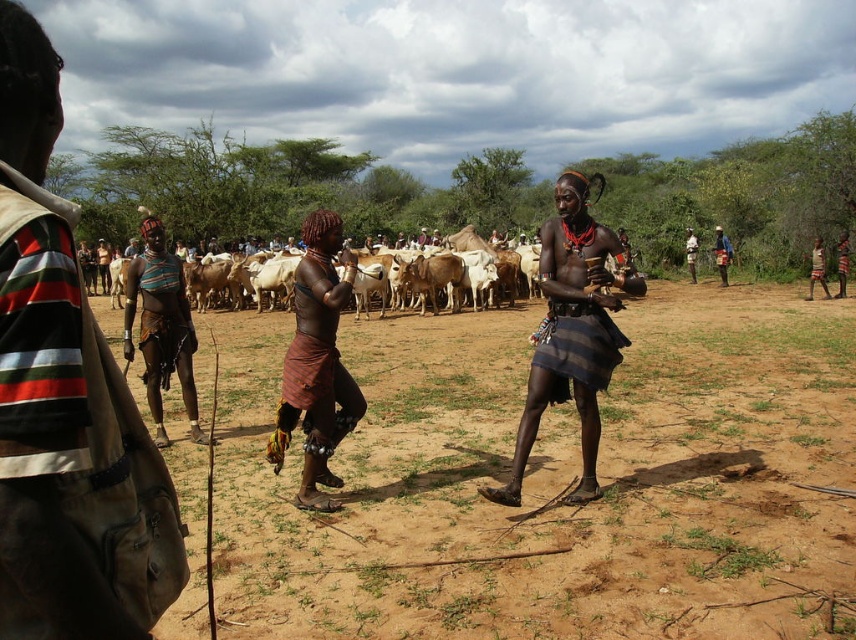
Is matte black skirt at center further to camera compared to matte brown skin at center?

No, it is in front of matte brown skin at center.

Is matte black skirt at center below matte brown skin at center?

No, matte black skirt at center is not below matte brown skin at center.

This screenshot has height=640, width=856. What are the coordinates of `matte black skirt at center` in the screenshot? It's located at (572, 330).

Is matte brown leather bag at left below matte black skirt at center?

Indeed, matte brown leather bag at left is positioned under matte black skirt at center.

Is matte brown leather bag at left bigger than matte black skirt at center?

Yes.

Is point (3, 93) more distant than point (607, 272)?

No.

This screenshot has height=640, width=856. In order to click on matte brown leather bag at left in this screenshot , I will do `click(64, 403)`.

Does brown sandy ground at center appear over brown woven skirt at center?

No, brown sandy ground at center is not above brown woven skirt at center.

Is brown sandy ground at center closer to camera compared to brown woven skirt at center?

Yes.

Does point (794, 344) lie in front of point (318, 225)?

No, it is not.

Find the location of `brown sandy ground at center`. brown sandy ground at center is located at coordinates (554, 481).